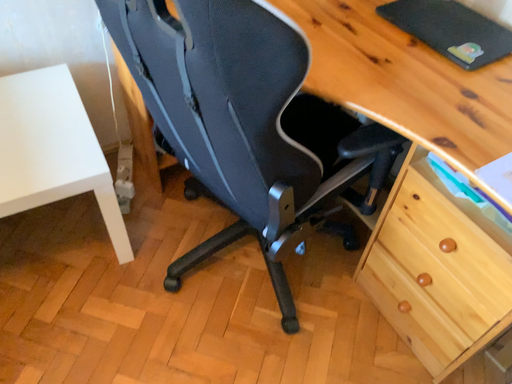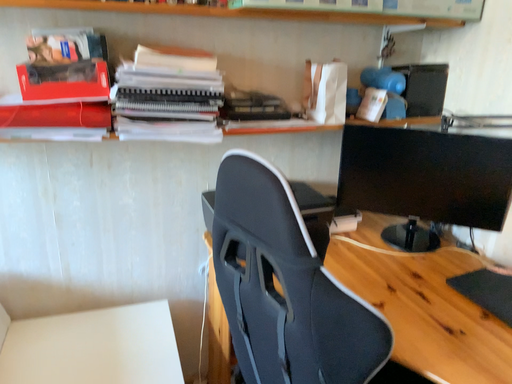
Question: Which way did the camera rotate in the video?

Choices:
 (A) rotated right
 (B) rotated left

Answer: (B)